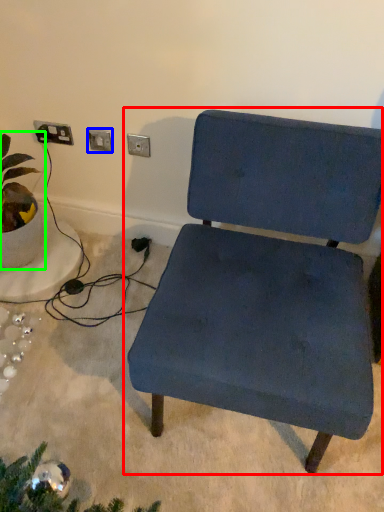
Question: Which object is positioned closest to chair (highlighted by a red box)? Select from electric outlet (highlighted by a blue box) and houseplant (highlighted by a green box).

Choices:
 (A) electric outlet
 (B) houseplant

Answer: (A)